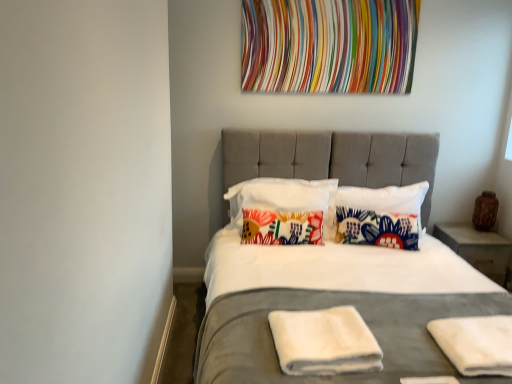
Question: Considering the relative sizes of floral fabric pillow at center, which appears as the 4th pillow when viewed from the right, and multicolored fabric at upper center in the image provided, is floral fabric pillow at center, which appears as the 4th pillow when viewed from the right, thinner than multicolored fabric at upper center?

Choices:
 (A) no
 (B) yes

Answer: (A)

Question: Is floral fabric pillow at center, the 1th pillow positioned from the left, located outside multicolored fabric at upper center?

Choices:
 (A) no
 (B) yes

Answer: (B)

Question: From the image's perspective, is floral fabric pillow at center, which appears as the 4th pillow when viewed from the right, beneath multicolored fabric at upper center?

Choices:
 (A) yes
 (B) no

Answer: (A)

Question: Is floral fabric pillow at center, which appears as the 4th pillow when viewed from the right, closer to the viewer compared to multicolored fabric at upper center?

Choices:
 (A) yes
 (B) no

Answer: (A)

Question: Considering the relative positions of floral fabric pillow at center, the 1th pillow positioned from the left, and multicolored fabric at upper center in the image provided, is floral fabric pillow at center, the 1th pillow positioned from the left, to the right of multicolored fabric at upper center from the viewer's perspective?

Choices:
 (A) no
 (B) yes

Answer: (A)

Question: From a real-world perspective, is floral fabric pillow at center, the 1th pillow positioned from the left, below multicolored fabric at upper center?

Choices:
 (A) yes
 (B) no

Answer: (A)

Question: Is multicolored fabric at upper center wider than white cotton pillow at center, the 2th pillow when ordered from left to right?

Choices:
 (A) yes
 (B) no

Answer: (B)

Question: Is multicolored fabric at upper center positioned with its back to white cotton pillow at center, which is the third pillow in right-to-left order?

Choices:
 (A) yes
 (B) no

Answer: (B)

Question: Does multicolored fabric at upper center come behind white cotton pillow at center, the 2th pillow when ordered from left to right?

Choices:
 (A) no
 (B) yes

Answer: (B)

Question: Can you confirm if multicolored fabric at upper center is thinner than white cotton pillow at center, which is the third pillow in right-to-left order?

Choices:
 (A) no
 (B) yes

Answer: (B)

Question: Is multicolored fabric at upper center at the right side of white cotton pillow at center, which is the third pillow in right-to-left order?

Choices:
 (A) yes
 (B) no

Answer: (A)

Question: Is multicolored fabric at upper center bigger than white cotton pillow at center, the 2th pillow when ordered from left to right?

Choices:
 (A) yes
 (B) no

Answer: (B)

Question: Is white towel at center, which is counted as the 1th material, starting from the left, outside of white cotton pillow at center, which is the third pillow in right-to-left order?

Choices:
 (A) yes
 (B) no

Answer: (A)